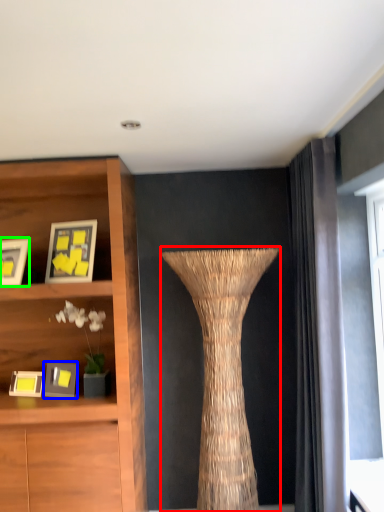
Question: Considering the real-world distances, which object is farthest from vase (highlighted by a red box)? picture frame (highlighted by a blue box) or picture frame (highlighted by a green box)?

Choices:
 (A) picture frame
 (B) picture frame

Answer: (B)